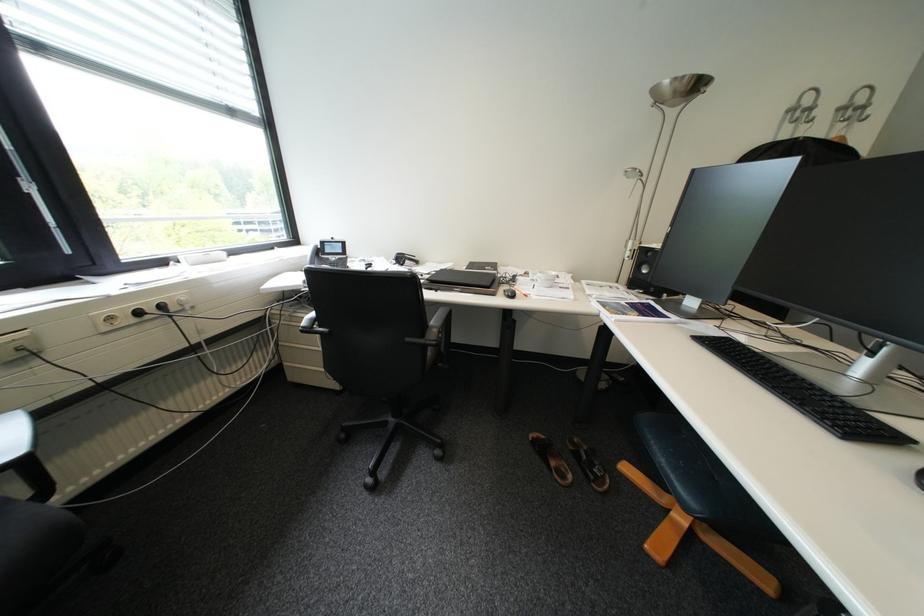
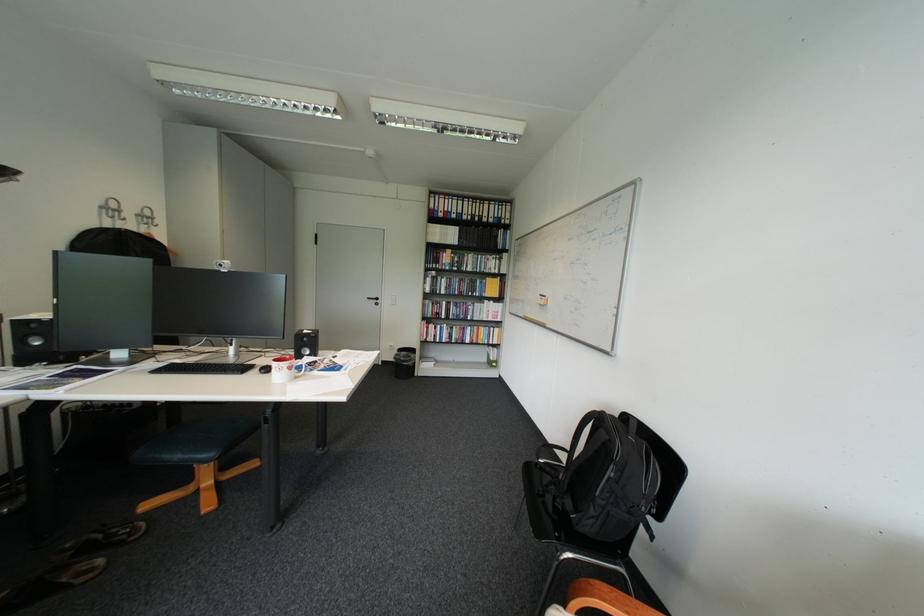
Where in the second image is the point corresponding to the point at 800,111 from the first image?

(114, 208)